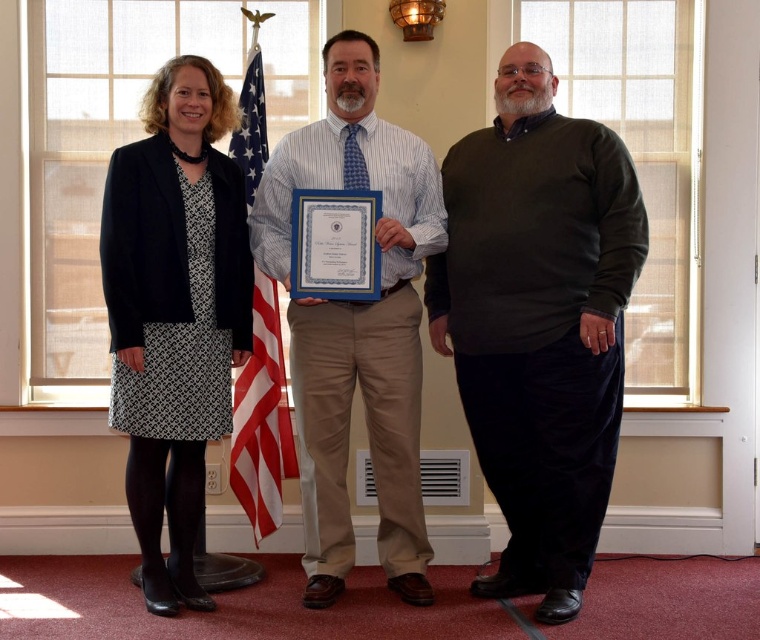
Question: Which is farther from the matte black dress at center?

Choices:
 (A) black textured dress at left
 (B) dark green sweater at center
 (C) american flag at center

Answer: (C)

Question: Which of the following is the farthest from the observer?

Choices:
 (A) (372, 424)
 (B) (293, 465)
 (C) (185, 250)

Answer: (B)

Question: Which point is farther to the camera?

Choices:
 (A) (277, 387)
 (B) (207, 212)
 (C) (318, 168)

Answer: (A)

Question: Considering the relative positions of matte black dress at center and dark green sweater at center in the image provided, where is matte black dress at center located with respect to dark green sweater at center?

Choices:
 (A) right
 (B) left

Answer: (B)

Question: Can you confirm if striped cotton shirt at center is smaller than american flag at center?

Choices:
 (A) no
 (B) yes

Answer: (A)

Question: Can you confirm if dark green sweater at center is positioned to the right of black textured dress at left?

Choices:
 (A) yes
 (B) no

Answer: (A)